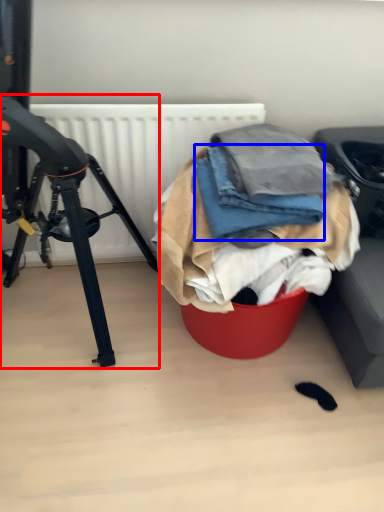
Question: Which of the following is the closest to the observer, tripod (highlighted by a red box) or clothing (highlighted by a blue box)?

Choices:
 (A) tripod
 (B) clothing

Answer: (A)